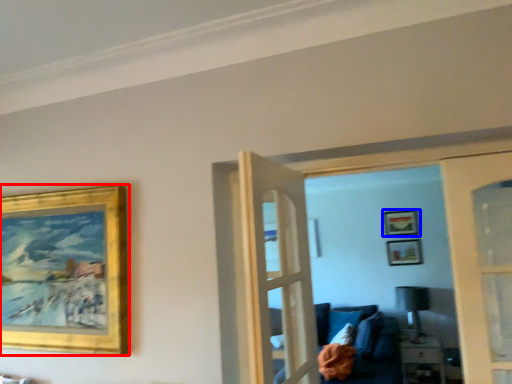
Question: Which point is further to the camera, picture frame (highlighted by a red box) or picture frame (highlighted by a blue box)?

Choices:
 (A) picture frame
 (B) picture frame

Answer: (B)